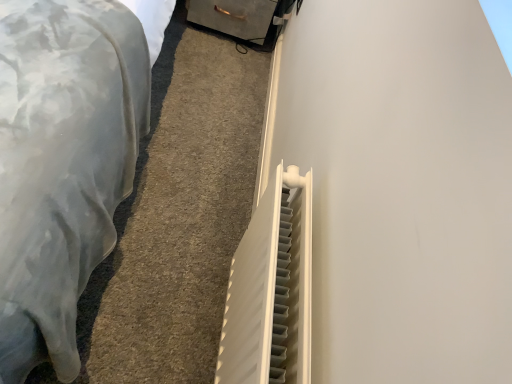
What are the coordinates of `free point below white plastic radiator at center-right (from a real-world perspective)` in the screenshot? It's located at (207, 338).